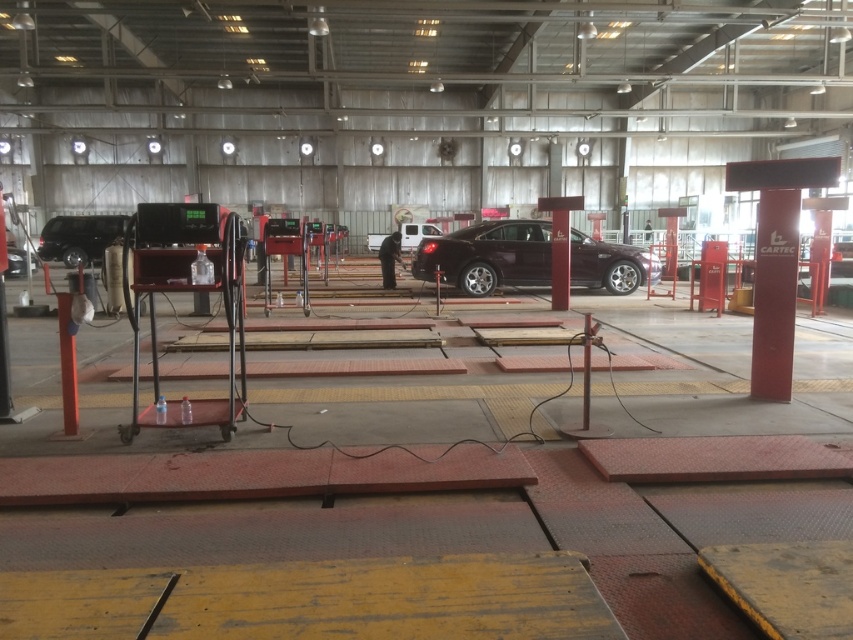
Question: Which point is closer to the camera?

Choices:
 (A) [45, 244]
 (B) [425, 224]
 (C) [611, 256]

Answer: (C)

Question: Does satin burgundy car at center have a greater width compared to white matte van at center?

Choices:
 (A) yes
 (B) no

Answer: (A)

Question: Which point is farther from the camera taking this photo?

Choices:
 (A) (425, 230)
 (B) (65, 236)
 (C) (480, 264)

Answer: (A)

Question: Is satin burgundy car at center behind shiny black car at left?

Choices:
 (A) no
 (B) yes

Answer: (A)

Question: Which point appears closest to the camera in this image?

Choices:
 (A) (90, 234)
 (B) (433, 225)
 (C) (538, 253)

Answer: (C)

Question: Is shiny black car at left closer to the viewer compared to white matte van at center?

Choices:
 (A) yes
 (B) no

Answer: (A)